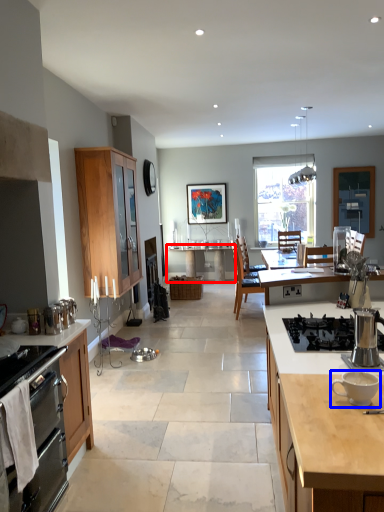
Question: Which of the following is the farthest to the observer, table (highlighted by a red box) or coffee cup (highlighted by a blue box)?

Choices:
 (A) table
 (B) coffee cup

Answer: (A)